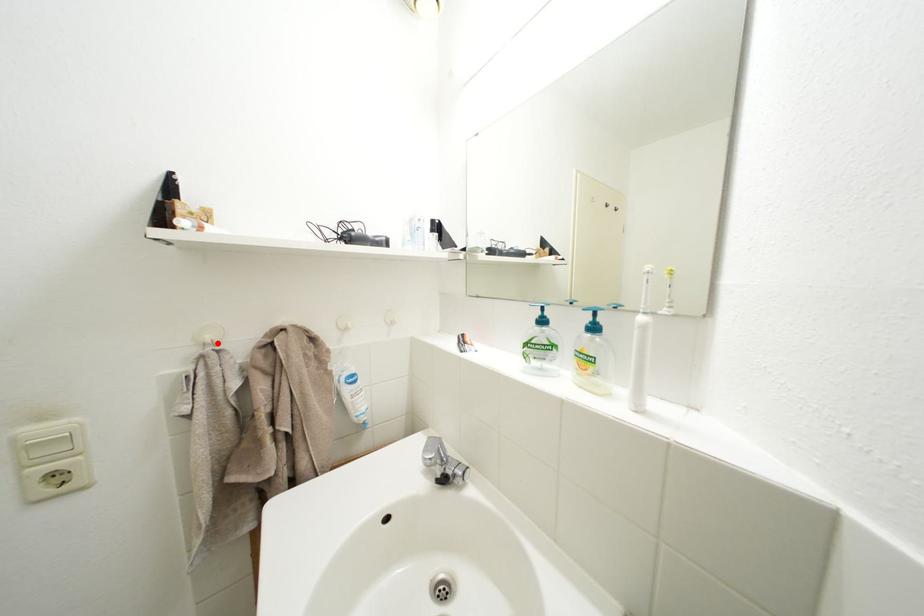
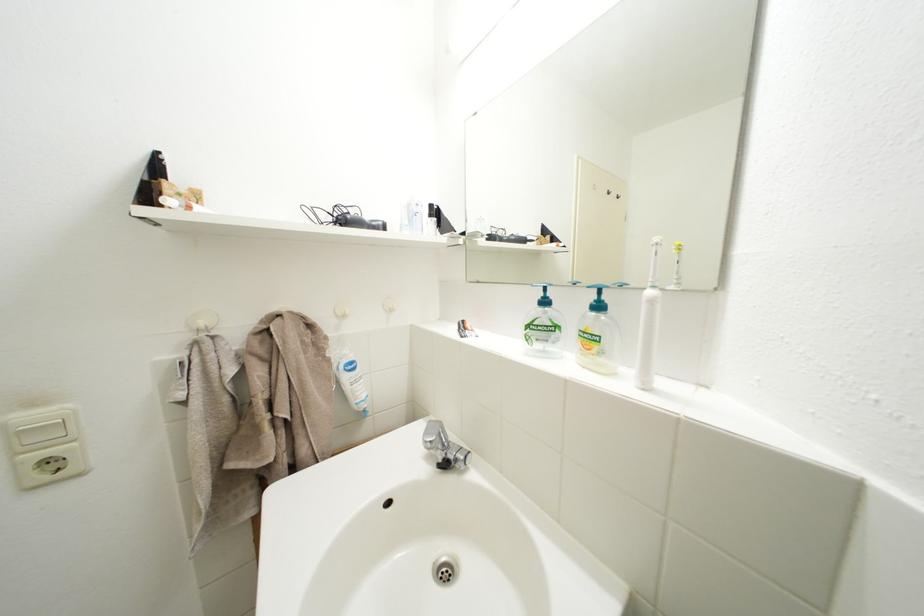
Where in the second image is the point corresponding to the highlighted location from the first image?

(211, 329)